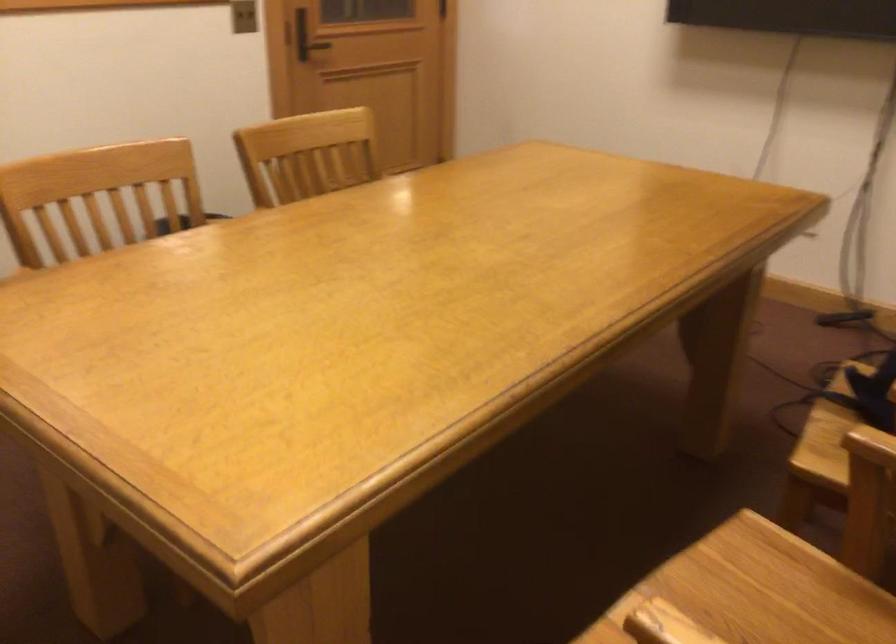
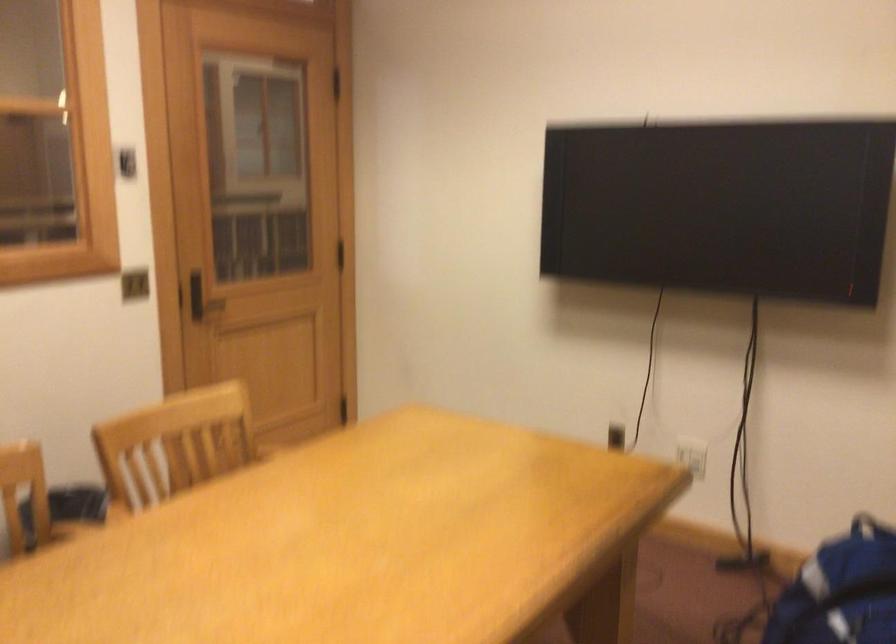
Question: The first image is from the beginning of the video and the second image is from the end. How did the camera likely rotate when shooting the video?

Choices:
 (A) Left
 (B) Right
 (C) Up
 (D) Down

Answer: (C)